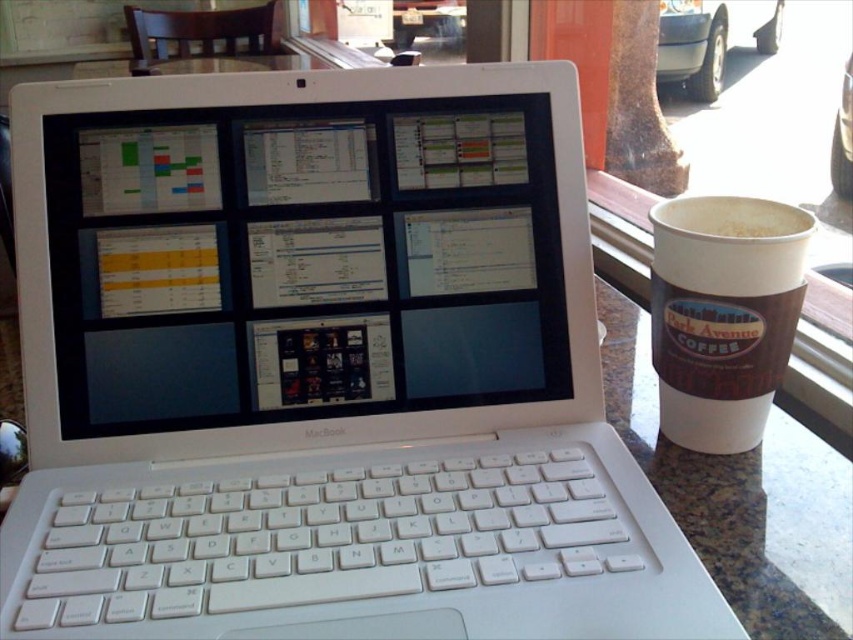
Question: Which of the following is the farthest from the observer?

Choices:
 (A) white glossy laptop at center
 (B) white plastic keyboard at center
 (C) brown paper cup at right
 (D) white paper cup at upper right

Answer: (A)

Question: Does white glossy laptop at center appear on the right side of white plastic keyboard at center?

Choices:
 (A) no
 (B) yes

Answer: (A)

Question: Which of these objects is positioned closest to the brown paper cup at right?

Choices:
 (A) white glossy laptop at center
 (B) white paper cup at upper right
 (C) white plastic keyboard at center

Answer: (B)

Question: Estimate the real-world distances between objects in this image. Which object is closer to the white glossy laptop at center?

Choices:
 (A) white plastic keyboard at center
 (B) brown paper cup at right
 (C) white paper cup at upper right

Answer: (A)

Question: Observing the image, what is the correct spatial positioning of white plastic keyboard at center in reference to white paper cup at upper right?

Choices:
 (A) left
 (B) right

Answer: (A)

Question: Is white plastic keyboard at center to the right of white paper cup at upper right from the viewer's perspective?

Choices:
 (A) yes
 (B) no

Answer: (B)